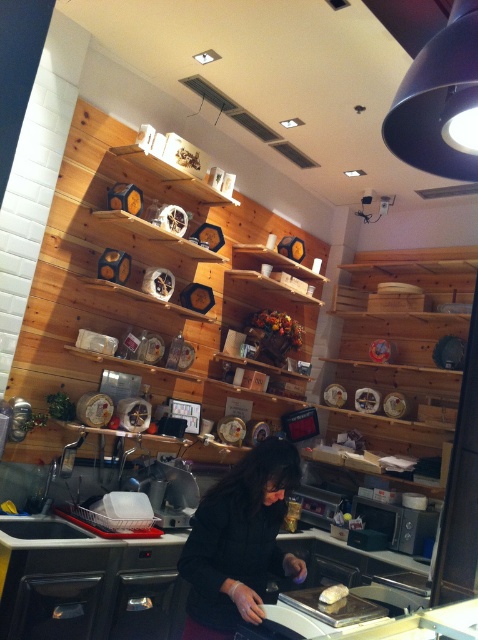
The height and width of the screenshot is (640, 478). Describe the element at coordinates (239, 541) in the screenshot. I see `black fabric at center` at that location.

Can you confirm if black fabric at center is thinner than satin black exhaust hood at upper right?

In fact, black fabric at center might be wider than satin black exhaust hood at upper right.

In the scene shown: Who is more distant from viewer, (254, 612) or (417, 120)?

Positioned behind is point (254, 612).

Locate an element on the screen. black fabric at center is located at coordinates (239, 541).

Which is below, satin black exhaust hood at upper right or white glossy bread at center?

white glossy bread at center

Does satin black exhaust hood at upper right have a lesser height compared to white glossy bread at center?

No.

The height and width of the screenshot is (640, 478). What are the coordinates of `satin black exhaust hood at upper right` in the screenshot? It's located at (438, 100).

Measure the distance between point (184, 552) and camera.

Point (184, 552) is 6.58 feet from camera.

Looking at this image, which is above, black fabric at center or white glossy bread at center?

Positioned higher is black fabric at center.

In order to click on black fabric at center in this screenshot , I will do `click(239, 541)`.

At what (x,y) coordinates should I click in order to perform the action: click on black fabric at center. Please return your answer as a coordinate pair (x, y). Looking at the image, I should click on (239, 541).